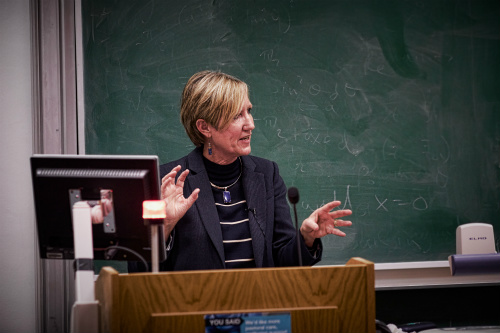
Locate an element on the screen. clean green chalkboard is located at coordinates (384, 35), (437, 232).